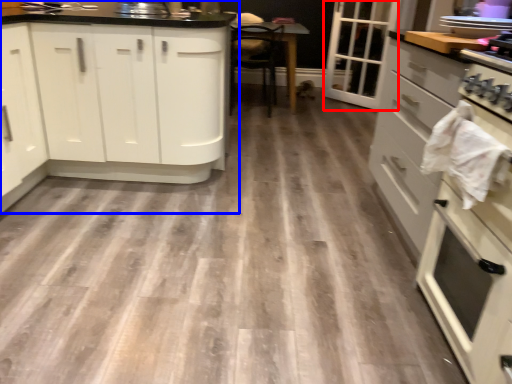
Question: Which point is further to the camera, glass door (highlighted by a red box) or cabinetry (highlighted by a blue box)?

Choices:
 (A) glass door
 (B) cabinetry

Answer: (A)